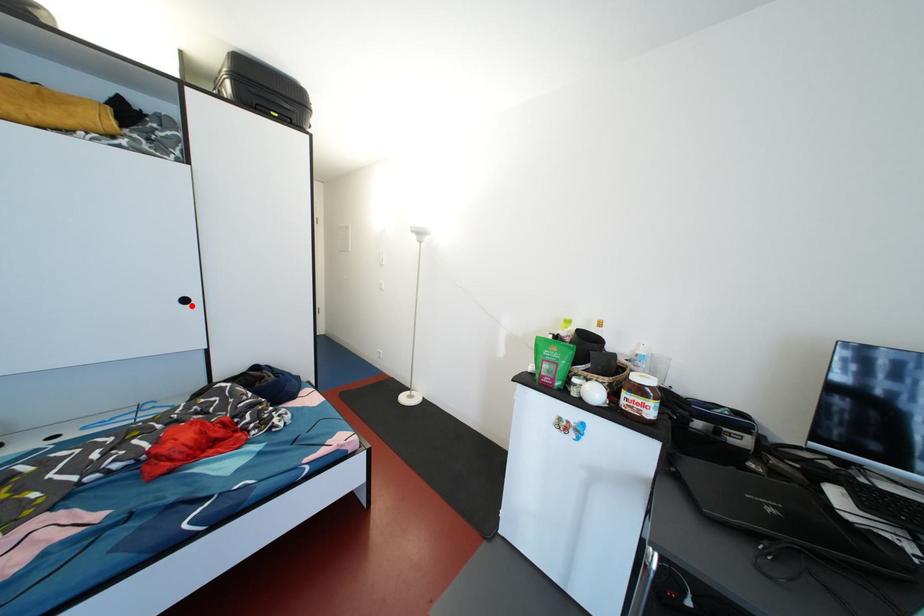
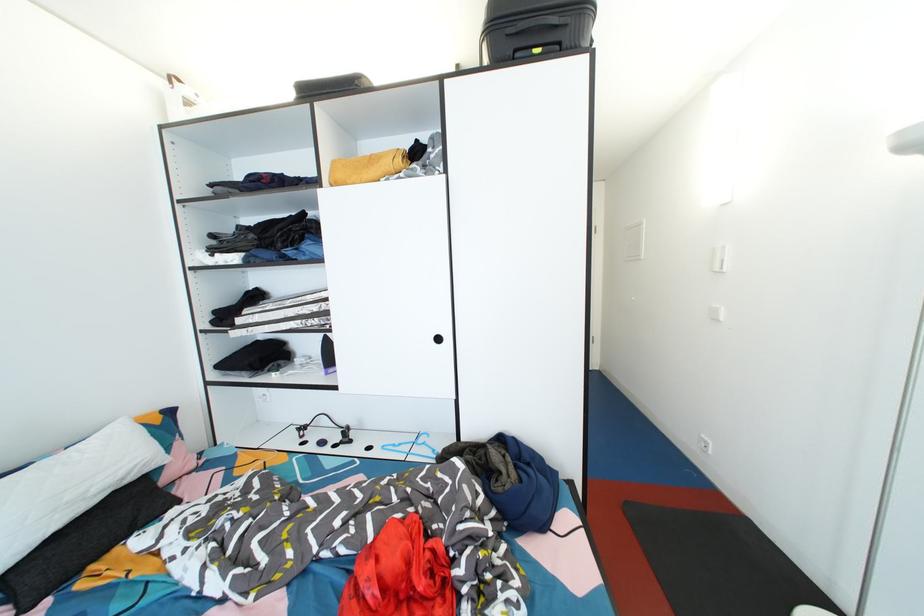
Locate, in the second image, the point that corresponds to the highlighted location in the first image.

(444, 344)